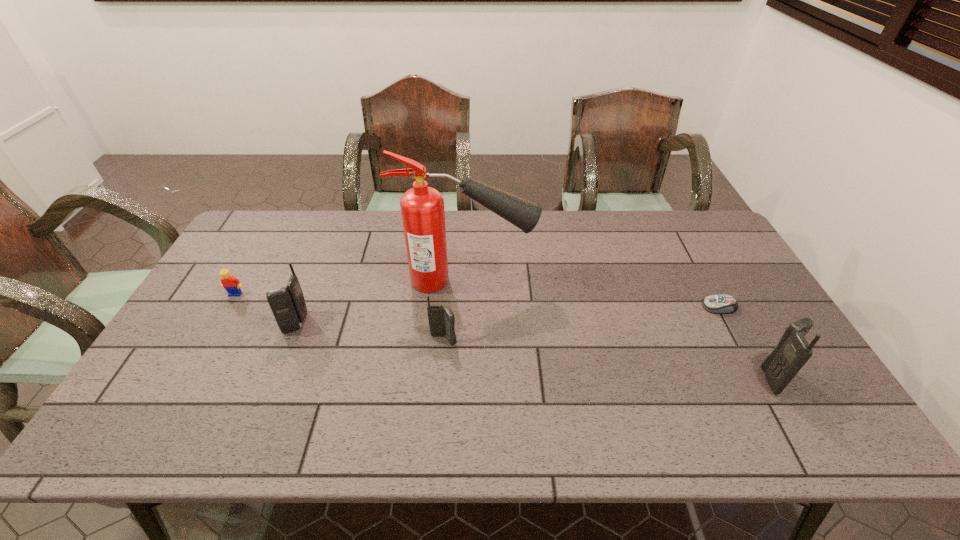
Image resolution: width=960 pixels, height=540 pixels. In the image, there is a desktop. What are the coordinates of `vacant space at the near left corner` in the screenshot? It's located at (163, 380).

This screenshot has width=960, height=540. What are the coordinates of `vacant region at the near right corner of the desktop` in the screenshot? It's located at pyautogui.click(x=824, y=401).

Locate an element on the screen. vacant space in between the second cellular telephone from left to right and the computer mouse is located at coordinates (582, 323).

Where is `free point between the second shortest object and the second tallest cellular telephone`? The image size is (960, 540). free point between the second shortest object and the second tallest cellular telephone is located at coordinates (266, 308).

Locate an element on the screen. This screenshot has height=540, width=960. free area in between the third shortest object and the nearest cellular telephone is located at coordinates (610, 359).

The image size is (960, 540). I want to click on unoccupied position between the shortest object and the fire extinguisher, so click(x=592, y=294).

Identify the location of vacant space that is in between the fifth tallest object and the third shortest object. Image resolution: width=960 pixels, height=540 pixels. (340, 317).

Locate an element on the screen. Image resolution: width=960 pixels, height=540 pixels. free space between the tallest cellular telephone and the tallest object is located at coordinates (620, 329).

Locate an element on the screen. This screenshot has width=960, height=540. blank region between the nearest cellular telephone and the leftmost cellular telephone is located at coordinates (536, 350).

The image size is (960, 540). I want to click on blank region between the rightmost cellular telephone and the second shortest object, so click(x=505, y=336).